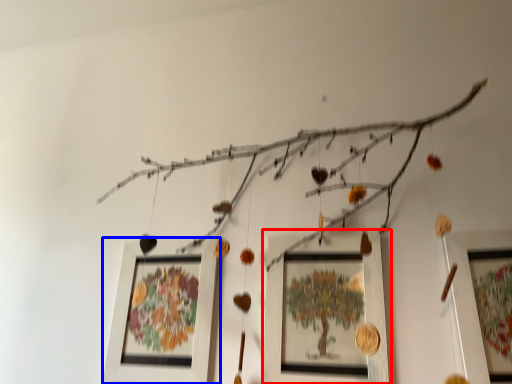
Question: Which object appears farthest to the camera in this image, picture frame (highlighted by a red box) or picture frame (highlighted by a blue box)?

Choices:
 (A) picture frame
 (B) picture frame

Answer: (B)